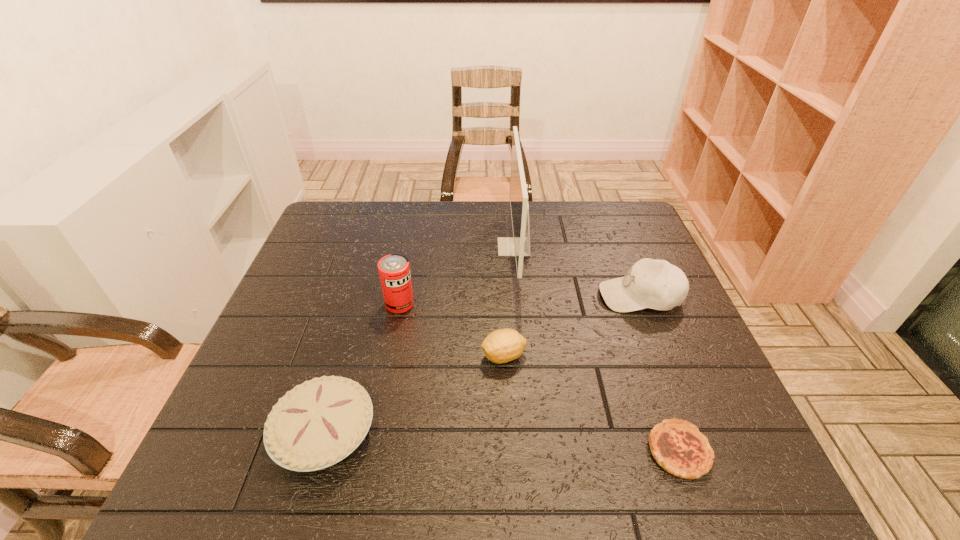
Where is `free space located 0.120m on the front-facing side of the baseball cap`? The height and width of the screenshot is (540, 960). free space located 0.120m on the front-facing side of the baseball cap is located at coordinates (553, 296).

Locate an element on the screen. This screenshot has width=960, height=540. vacant space located on the front-facing side of the baseball cap is located at coordinates (535, 296).

Where is `vacant position located on the front-facing side of the baseball cap`? vacant position located on the front-facing side of the baseball cap is located at coordinates (504, 296).

You are a GUI agent. You are given a task and a screenshot of the screen. Output one action in this format:
    pyautogui.click(x=<x>, y=<y>)
    Task: Click on the free spot located at the stem end of the lemon
    
    Given the screenshot: What is the action you would take?
    pyautogui.click(x=412, y=356)

You are a GUI agent. You are given a task and a screenshot of the screen. Output one action in this format:
    pyautogui.click(x=<x>, y=<y>)
    Task: Click on the free space located at the stem end of the lemon
    
    Given the screenshot: What is the action you would take?
    pyautogui.click(x=390, y=356)

This screenshot has width=960, height=540. Identify the location of free space located at the stem end of the lemon. (390, 356).

This screenshot has width=960, height=540. Find the location of `vacant region located on the right of the pie`. vacant region located on the right of the pie is located at coordinates (564, 432).

In order to click on vacant space positioned on the back of the quiche in this screenshot , I will do [x=659, y=394].

Identify the location of object located in the far edge section of the desktop. The width and height of the screenshot is (960, 540). (519, 246).

At what (x,y) coordinates should I click in order to perform the action: click on pie located at the near edge. Please return your answer as a coordinate pair (x, y). The height and width of the screenshot is (540, 960). Looking at the image, I should click on (317, 424).